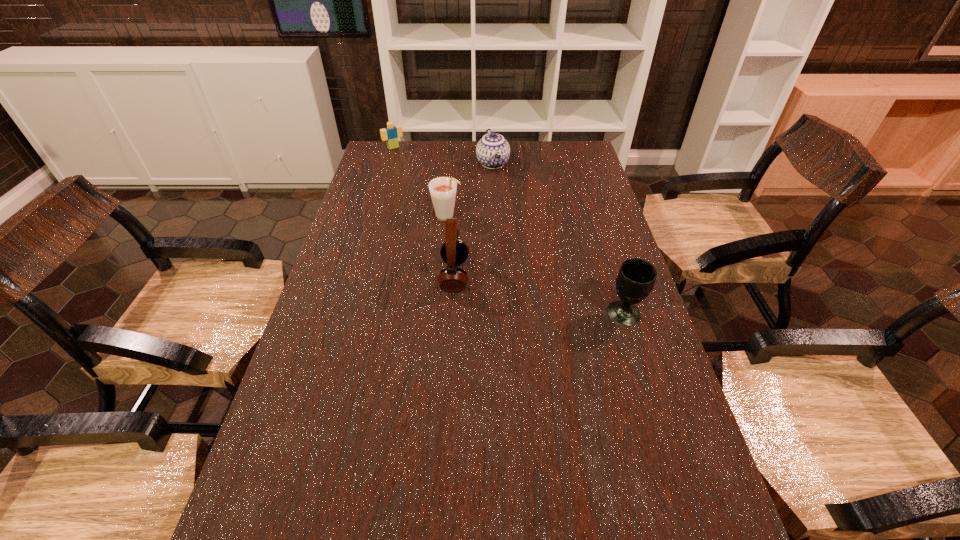
Where is `vacant space located 0.300m on the face of the Lego`? The height and width of the screenshot is (540, 960). vacant space located 0.300m on the face of the Lego is located at coordinates (429, 184).

Where is `chinaware that is at the far edge`? The width and height of the screenshot is (960, 540). chinaware that is at the far edge is located at coordinates (493, 151).

Locate an element on the screen. This screenshot has height=540, width=960. Lego positioned at the far edge is located at coordinates (391, 133).

Locate an element on the screen. The image size is (960, 540). object located at the left edge is located at coordinates (391, 133).

The width and height of the screenshot is (960, 540). What are the coordinates of `object that is at the right edge` in the screenshot? It's located at click(636, 277).

Find the location of a particular element. This screenshot has width=960, height=540. object at the far left corner is located at coordinates (391, 133).

Where is `free region at the far edge of the desktop`? The width and height of the screenshot is (960, 540). free region at the far edge of the desktop is located at coordinates (444, 158).

This screenshot has height=540, width=960. Find the location of `vacant space at the left edge`. vacant space at the left edge is located at coordinates (271, 471).

Where is `vacant space at the right edge of the desktop`? Image resolution: width=960 pixels, height=540 pixels. vacant space at the right edge of the desktop is located at coordinates (588, 177).

Where is `free space between the Lego and the nearest object`? Image resolution: width=960 pixels, height=540 pixels. free space between the Lego and the nearest object is located at coordinates (509, 231).